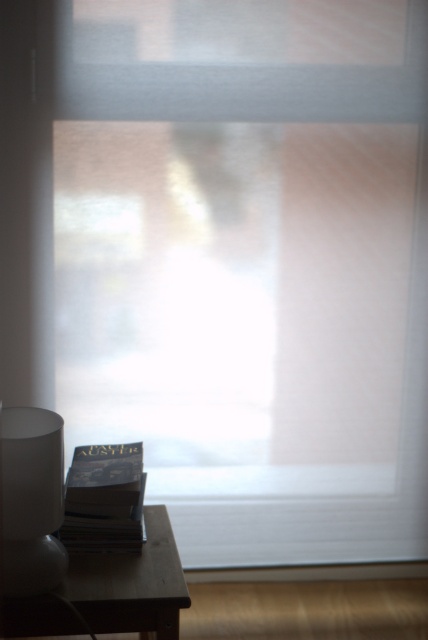
Does wooden table at lower left have a smaller size compared to matte black book at lower left?

Actually, wooden table at lower left might be larger than matte black book at lower left.

Is wooden table at lower left shorter than matte black book at lower left?

Yes.

Does point (79, 582) come closer to viewer compared to point (121, 488)?

Yes, it is.

The height and width of the screenshot is (640, 428). What are the coordinates of `wooden table at lower left` in the screenshot? It's located at (131, 582).

Is wooden table at lower left smaller than white frosted glass lamp at lower left?

No.

Looking at this image, can you confirm if wooden table at lower left is thinner than white frosted glass lamp at lower left?

Incorrect, wooden table at lower left's width is not less than white frosted glass lamp at lower left's.

Find the location of a particular element. This screenshot has width=428, height=640. wooden table at lower left is located at coordinates (131, 582).

Between white frosted glass lamp at lower left and matte black book at lower left, which one appears on the left side from the viewer's perspective?

From the viewer's perspective, white frosted glass lamp at lower left appears more on the left side.

Can you confirm if white frosted glass lamp at lower left is positioned below matte black book at lower left?

Incorrect, white frosted glass lamp at lower left is not positioned below matte black book at lower left.

Find the location of a particular element. white frosted glass lamp at lower left is located at coordinates click(x=32, y=499).